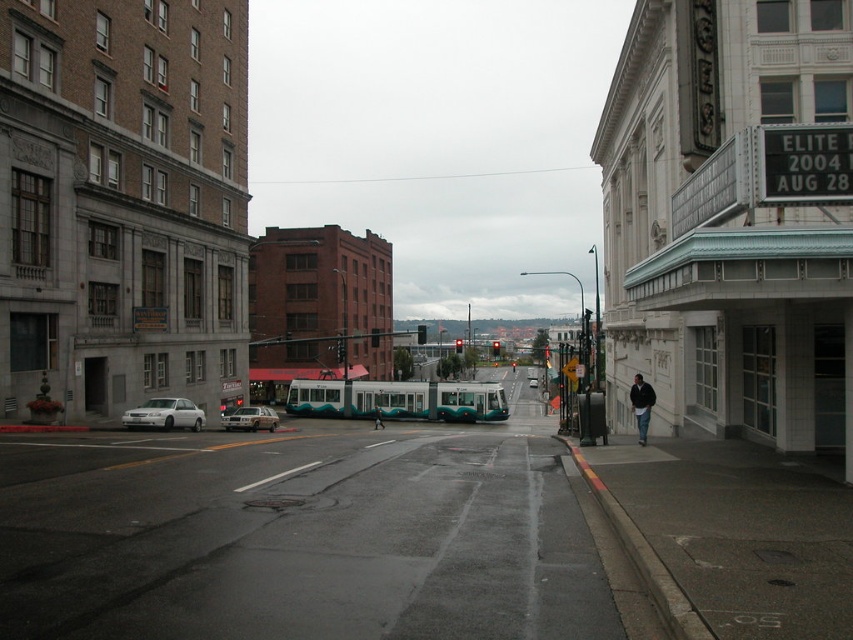
You are standing on the sidewalk and see the white matte sedan at left and the dark blue jeans at center. Which object is nearer to you?

The white matte sedan at left is closer to the viewer than the dark blue jeans at center, so the white matte sedan at left is nearer to you.

From the picture: You are a delivery person who needs to park your 12 foot long truck between the white matte sedan at left and the building. Is there enough space?

The distance between the white matte sedan at left and the building is 107.67 feet, so yes, there is enough space to park a 12 foot long truck between them.